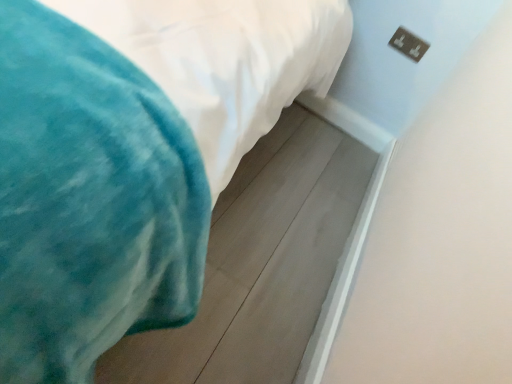
Question: Is metallic silver outlet at upper right placed right next to velvet teal blanket at lower left?

Choices:
 (A) yes
 (B) no

Answer: (B)

Question: Does metallic silver outlet at upper right have a smaller size compared to velvet teal blanket at lower left?

Choices:
 (A) no
 (B) yes

Answer: (B)

Question: Considering the relative sizes of metallic silver outlet at upper right and velvet teal blanket at lower left in the image provided, is metallic silver outlet at upper right bigger than velvet teal blanket at lower left?

Choices:
 (A) yes
 (B) no

Answer: (B)

Question: Considering the relative positions of metallic silver outlet at upper right and velvet teal blanket at lower left in the image provided, is metallic silver outlet at upper right to the right of velvet teal blanket at lower left from the viewer's perspective?

Choices:
 (A) yes
 (B) no

Answer: (A)

Question: Is metallic silver outlet at upper right not near velvet teal blanket at lower left?

Choices:
 (A) yes
 (B) no

Answer: (A)

Question: From the image's perspective, would you say metallic silver outlet at upper right is shown under velvet teal blanket at lower left?

Choices:
 (A) no
 (B) yes

Answer: (A)

Question: Does velvet teal blanket at lower left have a lesser height compared to metallic silver outlet at upper right?

Choices:
 (A) yes
 (B) no

Answer: (A)

Question: Does velvet teal blanket at lower left have a smaller size compared to metallic silver outlet at upper right?

Choices:
 (A) yes
 (B) no

Answer: (B)

Question: Does velvet teal blanket at lower left have a lesser width compared to metallic silver outlet at upper right?

Choices:
 (A) yes
 (B) no

Answer: (B)

Question: From the image's perspective, does velvet teal blanket at lower left appear lower than metallic silver outlet at upper right?

Choices:
 (A) yes
 (B) no

Answer: (A)

Question: Is velvet teal blanket at lower left to the right of metallic silver outlet at upper right from the viewer's perspective?

Choices:
 (A) yes
 (B) no

Answer: (B)

Question: Is metallic silver outlet at upper right inside velvet teal blanket at lower left?

Choices:
 (A) no
 (B) yes

Answer: (A)

Question: In terms of width, does velvet teal blanket at lower left look wider or thinner when compared to metallic silver outlet at upper right?

Choices:
 (A) thin
 (B) wide

Answer: (B)